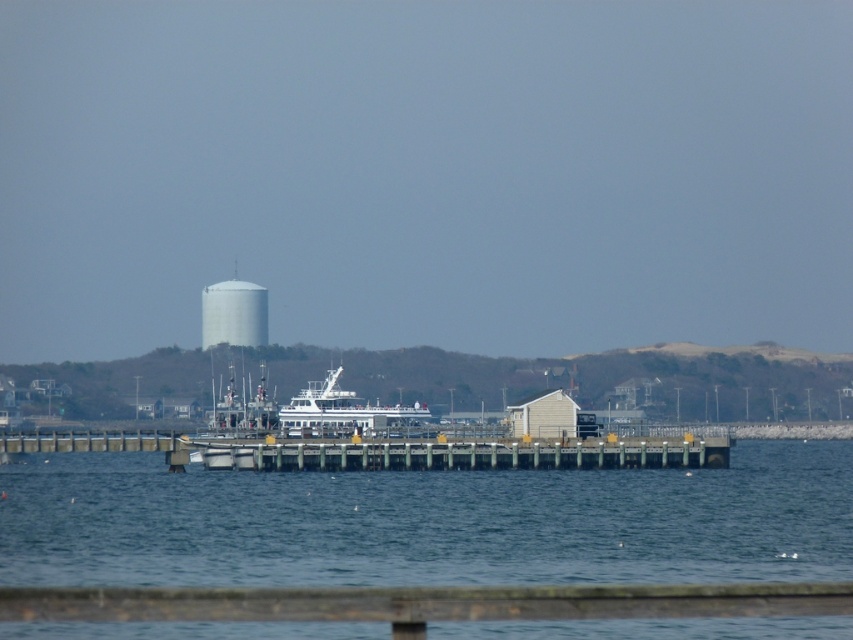
You are a photographer standing on the pier and want to capture both the blue water at center and the white matte ferry at center in your shot. Which object will appear larger in the photo?

The blue water at center will appear larger in the photo because it is much taller than the white matte ferry at center.

You are standing on the wooden dock at center and want to board the ferry. Which direction should you move to reach the ferry?

The wooden dock at center is located at point (460,454), so you should move towards the ferry which is docked at the pier in the middle ground to reach it.

You are standing on the wooden dock at center and want to see the white matte water tower at center. Is the water tower visible from your current position?

The wooden dock at center is in front of the white matte water tower at center, so the water tower may be partially or fully blocked from view depending on the dock structure.